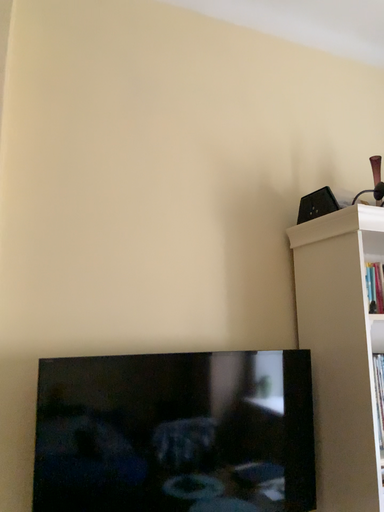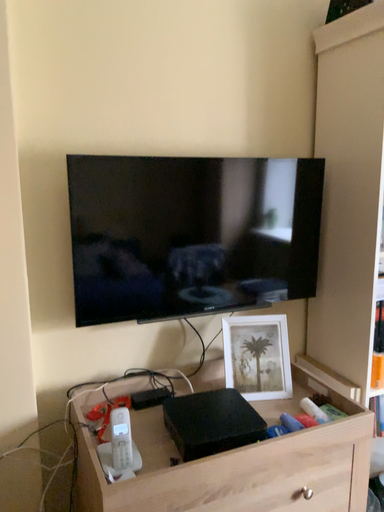
Question: Which way did the camera rotate in the video?

Choices:
 (A) rotated upward
 (B) rotated downward

Answer: (B)